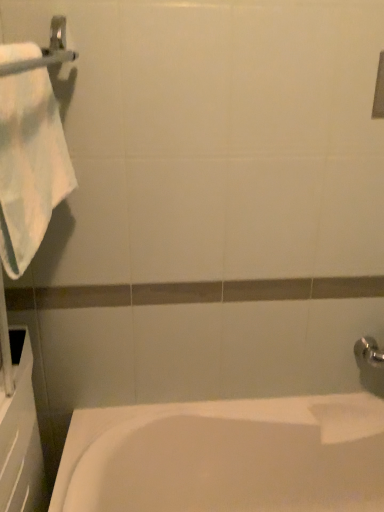
Question: Is point (296, 466) positioned closer to the camera than point (72, 57)?

Choices:
 (A) farther
 (B) closer

Answer: (A)

Question: Is white glossy bathtub at lower left to the left or to the right of silver metallic towel bar at upper left in the image?

Choices:
 (A) left
 (B) right

Answer: (B)

Question: Based on their relative distances, which object is nearer to the silver metallic towel bar at upper left?

Choices:
 (A) white cotton towel at left
 (B) white glossy bathtub at lower left

Answer: (A)

Question: Considering the real-world distances, which object is farthest from the white glossy bathtub at lower left?

Choices:
 (A) silver metallic towel bar at upper left
 (B) white cotton towel at left

Answer: (A)